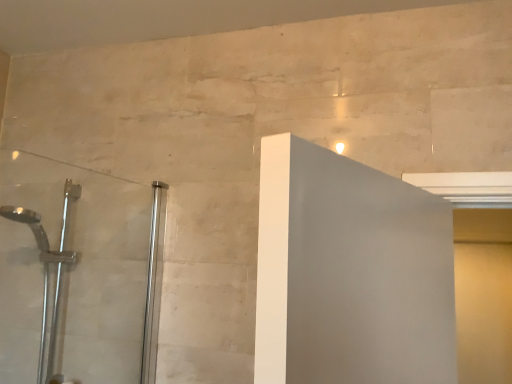
Question: Is matte yellow screen door at right next to clear glass shower door at left and touching it?

Choices:
 (A) yes
 (B) no

Answer: (B)

Question: From the image's perspective, is matte yellow screen door at right on clear glass shower door at left?

Choices:
 (A) no
 (B) yes

Answer: (A)

Question: From a real-world perspective, is matte yellow screen door at right located higher than clear glass shower door at left?

Choices:
 (A) no
 (B) yes

Answer: (A)

Question: Can you confirm if matte yellow screen door at right is bigger than clear glass shower door at left?

Choices:
 (A) yes
 (B) no

Answer: (A)

Question: Considering the relative positions of matte yellow screen door at right and clear glass shower door at left in the image provided, is matte yellow screen door at right in front of clear glass shower door at left?

Choices:
 (A) no
 (B) yes

Answer: (A)

Question: Is silver metallic shower head at left to the left or to the right of matte yellow screen door at right in the image?

Choices:
 (A) right
 (B) left

Answer: (B)

Question: Is silver metallic shower head at left spatially inside matte yellow screen door at right, or outside of it?

Choices:
 (A) outside
 (B) inside

Answer: (A)

Question: Considering the positions of silver metallic shower head at left and matte yellow screen door at right in the image, is silver metallic shower head at left bigger or smaller than matte yellow screen door at right?

Choices:
 (A) big
 (B) small

Answer: (A)

Question: Considering the positions of silver metallic shower head at left and matte yellow screen door at right in the image, is silver metallic shower head at left wider or thinner than matte yellow screen door at right?

Choices:
 (A) thin
 (B) wide

Answer: (B)

Question: Considering the positions of silver metallic shower head at left and clear glass shower door at left in the image, is silver metallic shower head at left taller or shorter than clear glass shower door at left?

Choices:
 (A) tall
 (B) short

Answer: (A)

Question: From a real-world perspective, is silver metallic shower head at left above or below clear glass shower door at left?

Choices:
 (A) above
 (B) below

Answer: (B)

Question: Looking at their shapes, would you say silver metallic shower head at left is wider or thinner than clear glass shower door at left?

Choices:
 (A) thin
 (B) wide

Answer: (B)

Question: In terms of size, does silver metallic shower head at left appear bigger or smaller than clear glass shower door at left?

Choices:
 (A) big
 (B) small

Answer: (A)

Question: Would you say matte yellow screen door at right is to the left or to the right of silver metallic shower head at left in the picture?

Choices:
 (A) right
 (B) left

Answer: (A)

Question: From the image's perspective, is matte yellow screen door at right positioned above or below silver metallic shower head at left?

Choices:
 (A) below
 (B) above

Answer: (A)